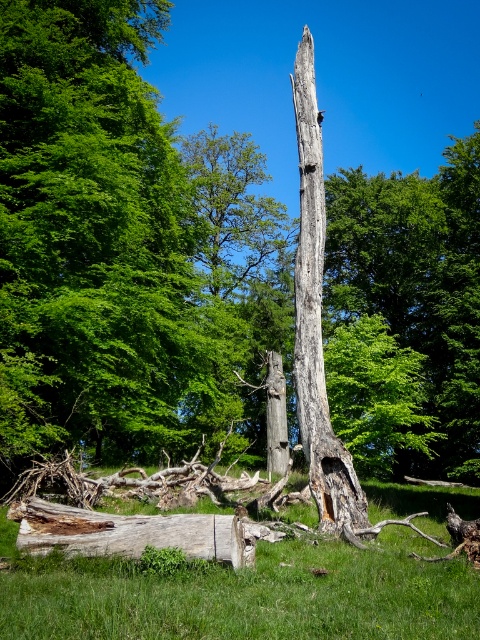
You are standing at the base of the tall, weathered tree trunk in the forest scene. You notice a point marked at coordinates [244,595]. What is located at that point?

The point at coordinates [244,595] corresponds to green grass at center.